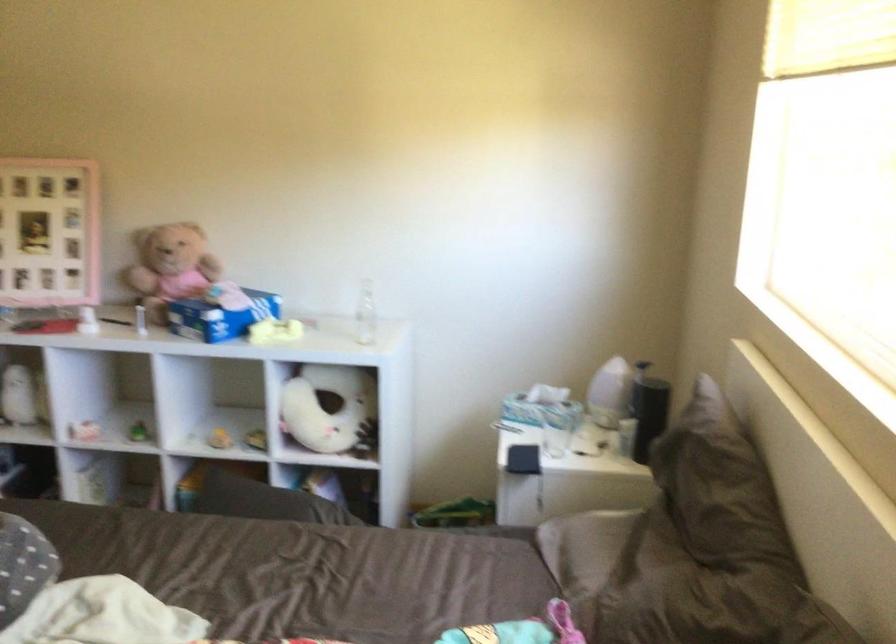
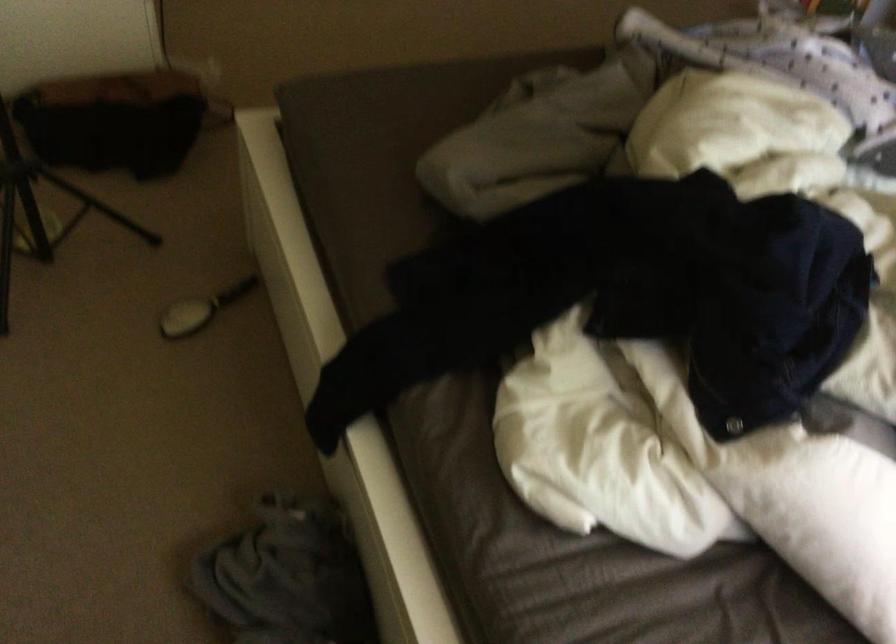
The first image is from the beginning of the video and the second image is from the end. How did the camera likely rotate when shooting the video?

The camera rotated toward left-down.